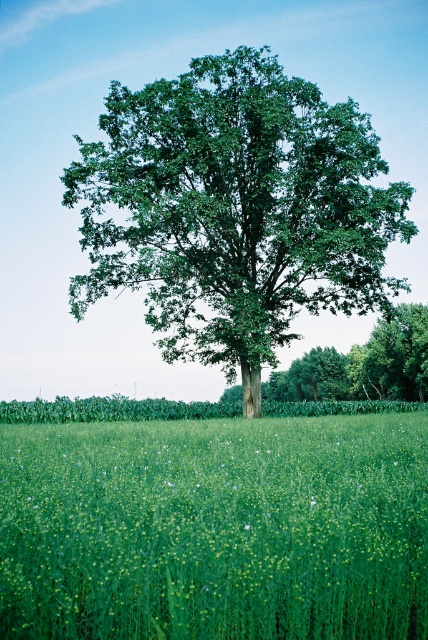
Question: Among these points, which one is nearest to the camera?

Choices:
 (A) (202, 424)
 (B) (404, 355)

Answer: (A)

Question: Does green grass at center have a lesser width compared to green leafy oak tree at center?

Choices:
 (A) yes
 (B) no

Answer: (A)

Question: Does green grass at center appear on the left side of green leafy oak tree at center?

Choices:
 (A) yes
 (B) no

Answer: (B)

Question: Can you confirm if green leafy oak tree at center is positioned above green leafy tree at center?

Choices:
 (A) no
 (B) yes

Answer: (B)

Question: Among these points, which one is farthest from the camera?

Choices:
 (A) (208, 148)
 (B) (398, 317)
 (C) (285, 520)

Answer: (B)

Question: Based on their relative distances, which object is nearer to the green leafy oak tree at center?

Choices:
 (A) green leafy tree at center
 (B) green grass at center

Answer: (B)